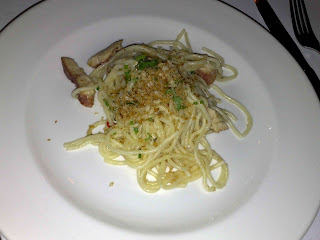
Locate an element on the screen. The width and height of the screenshot is (320, 240). fork is located at coordinates (301, 32).